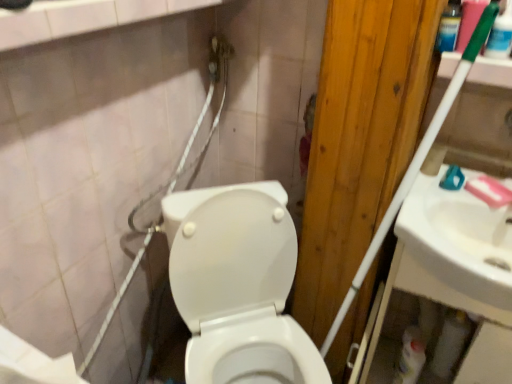
Question: From a real-world perspective, is white glossy bottle at lower right below white glossy sink at right?

Choices:
 (A) no
 (B) yes

Answer: (B)

Question: Is white glossy bottle at lower right further to camera compared to white glossy sink at right?

Choices:
 (A) no
 (B) yes

Answer: (B)

Question: Is white glossy bottle at lower right to the right of white glossy sink at right from the viewer's perspective?

Choices:
 (A) no
 (B) yes

Answer: (A)

Question: Can you confirm if white glossy bottle at lower right is bigger than white glossy sink at right?

Choices:
 (A) yes
 (B) no

Answer: (B)

Question: Can you confirm if white glossy bottle at lower right is thinner than white glossy sink at right?

Choices:
 (A) yes
 (B) no

Answer: (A)

Question: In terms of height, does white glossy sink at right look taller or shorter compared to white matte toilet paper at lower left, the second toilet paper viewed from the right?

Choices:
 (A) short
 (B) tall

Answer: (B)

Question: From the image's perspective, relative to white matte toilet paper at lower left, placed as the 1th toilet paper when sorted from left to right, is white glossy sink at right above or below?

Choices:
 (A) below
 (B) above

Answer: (B)

Question: Considering the positions of white glossy sink at right and white matte toilet paper at lower left, the 1th toilet paper viewed from the front, in the image, is white glossy sink at right bigger or smaller than white matte toilet paper at lower left, the 1th toilet paper viewed from the front,?

Choices:
 (A) small
 (B) big

Answer: (B)

Question: Considering the relative positions of white glossy sink at right and white matte toilet paper at lower left, the 1th toilet paper viewed from the front, in the image provided, is white glossy sink at right to the left or to the right of white matte toilet paper at lower left, the 1th toilet paper viewed from the front,?

Choices:
 (A) right
 (B) left

Answer: (A)

Question: Considering their positions, is white matte toilet paper at lower right, the 1th toilet paper positioned from the right, located in front of or behind white glossy toilet at center?

Choices:
 (A) behind
 (B) front

Answer: (A)

Question: Is white matte toilet paper at lower right, which appears as the 2th toilet paper when viewed from the left, inside the boundaries of white glossy toilet at center, or outside?

Choices:
 (A) outside
 (B) inside

Answer: (A)

Question: Looking at their shapes, would you say white matte toilet paper at lower right, which is counted as the 1th toilet paper, starting from the back, is wider or thinner than white glossy toilet at center?

Choices:
 (A) wide
 (B) thin

Answer: (B)

Question: Is white matte toilet paper at lower right, which is counted as the 1th toilet paper, starting from the back, bigger or smaller than white glossy toilet at center?

Choices:
 (A) big
 (B) small

Answer: (B)

Question: From the image's perspective, relative to pink matte soap at upper right, is white glossy sink at right above or below?

Choices:
 (A) below
 (B) above

Answer: (A)

Question: Considering the positions of point (413, 213) and point (487, 185), is point (413, 213) closer or farther from the camera than point (487, 185)?

Choices:
 (A) farther
 (B) closer

Answer: (B)